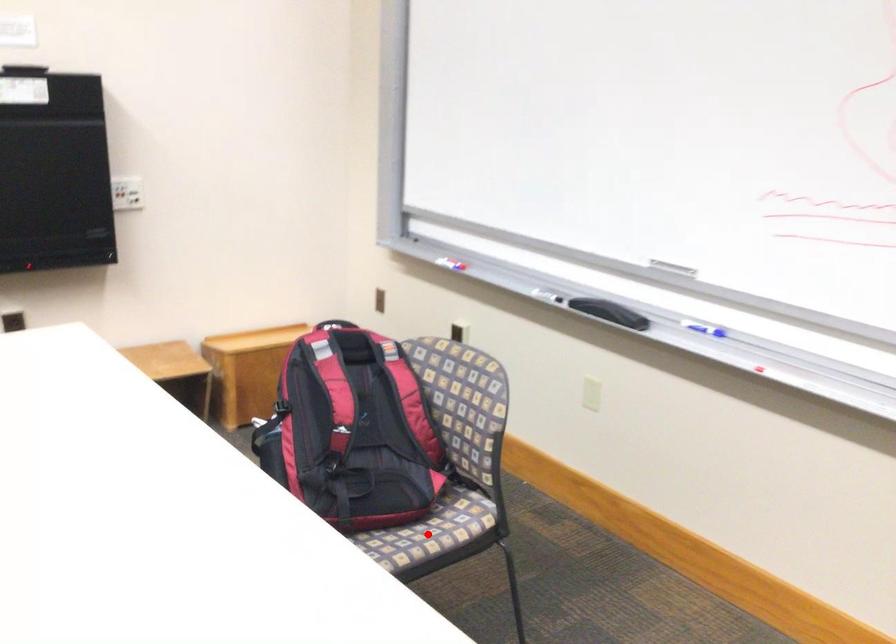
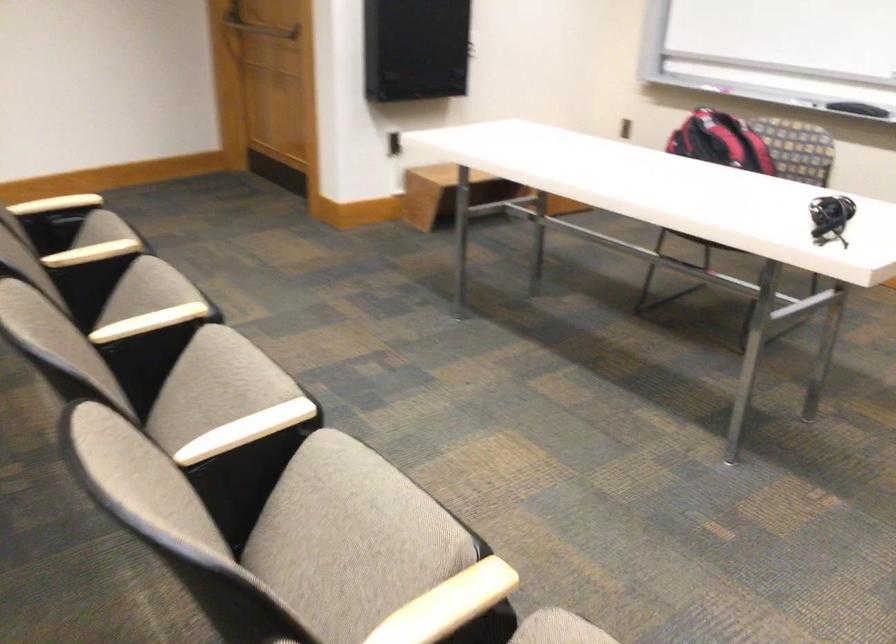
Question: I am providing you with two images of the same scene from different viewpoints. A red point is marked on the first image. At the location where the point appears in image 1, is it still visible in image 2?

Choices:
 (A) Yes
 (B) No

Answer: (B)